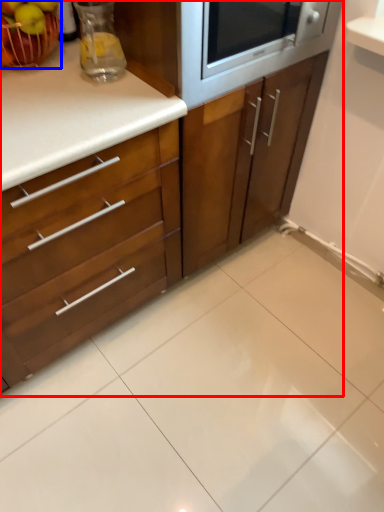
Question: Among these objects, which one is farthest to the camera, cabinetry (highlighted by a red box) or apple (highlighted by a blue box)?

Choices:
 (A) cabinetry
 (B) apple

Answer: (B)